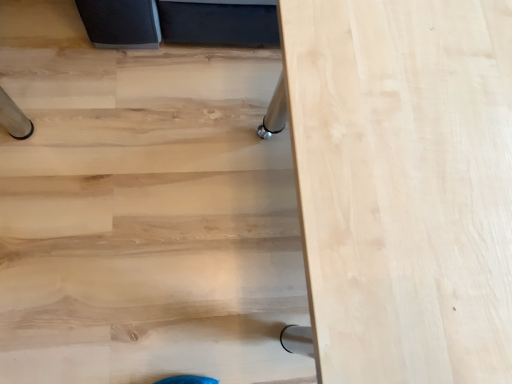
The width and height of the screenshot is (512, 384). In order to click on free space that is to the left of natural wood table at center in this screenshot , I will do `click(144, 174)`.